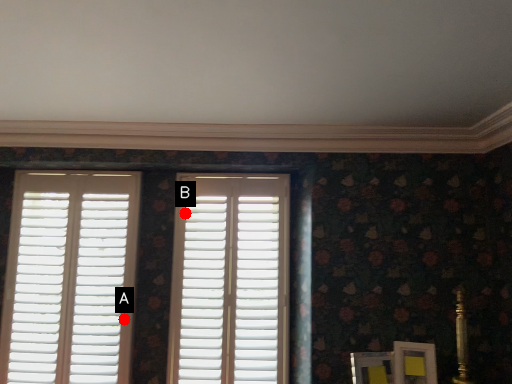
Question: Two points are circled on the image, labeled by A and B beside each circle. Which point appears closest to the camera in this image?

Choices:
 (A) A is closer
 (B) B is closer

Answer: (A)